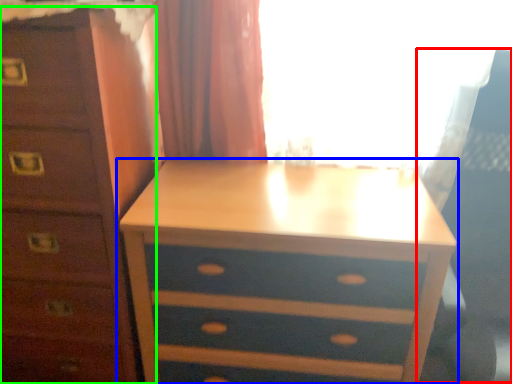
Question: Estimate the real-world distances between objects in this image. Which object is farther from swivel chair (highlighted by a red box), nightstand (highlighted by a blue box) or chest of drawers (highlighted by a green box)?

Choices:
 (A) nightstand
 (B) chest of drawers

Answer: (B)